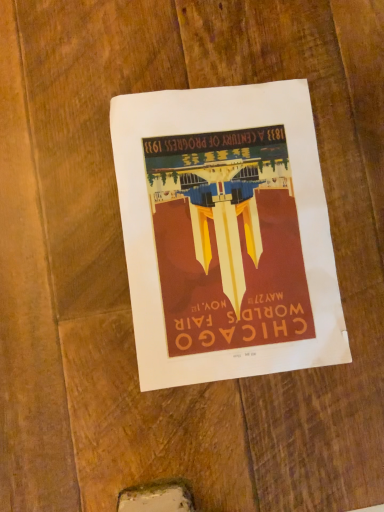
Locate an element on the screen. The width and height of the screenshot is (384, 512). matte paper poster at center is located at coordinates (226, 234).

Image resolution: width=384 pixels, height=512 pixels. What do you see at coordinates (226, 234) in the screenshot? I see `matte paper poster at center` at bounding box center [226, 234].

At what (x,y) coordinates should I click in order to perform the action: click on matte paper poster at center. Please return your answer as a coordinate pair (x, y). Looking at the image, I should click on (226, 234).